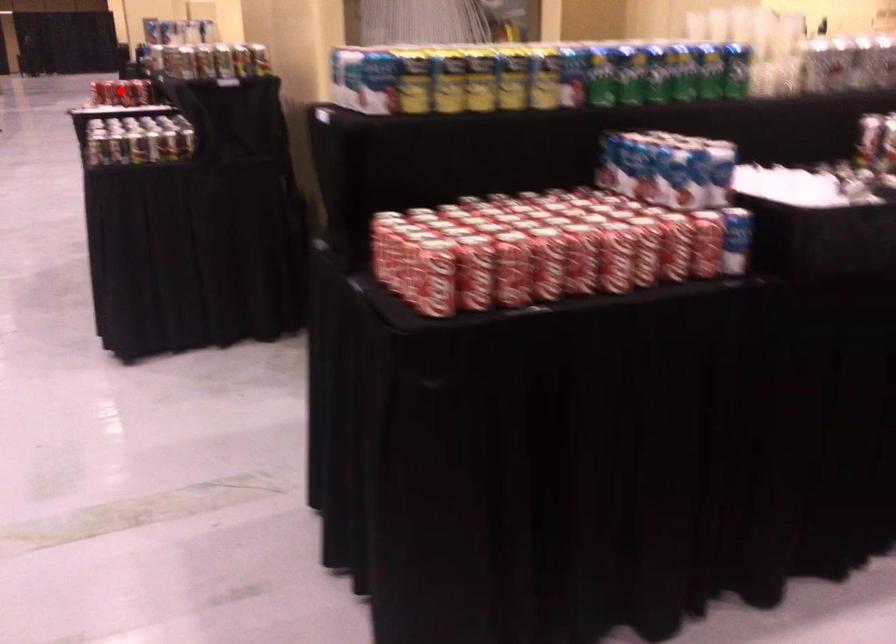
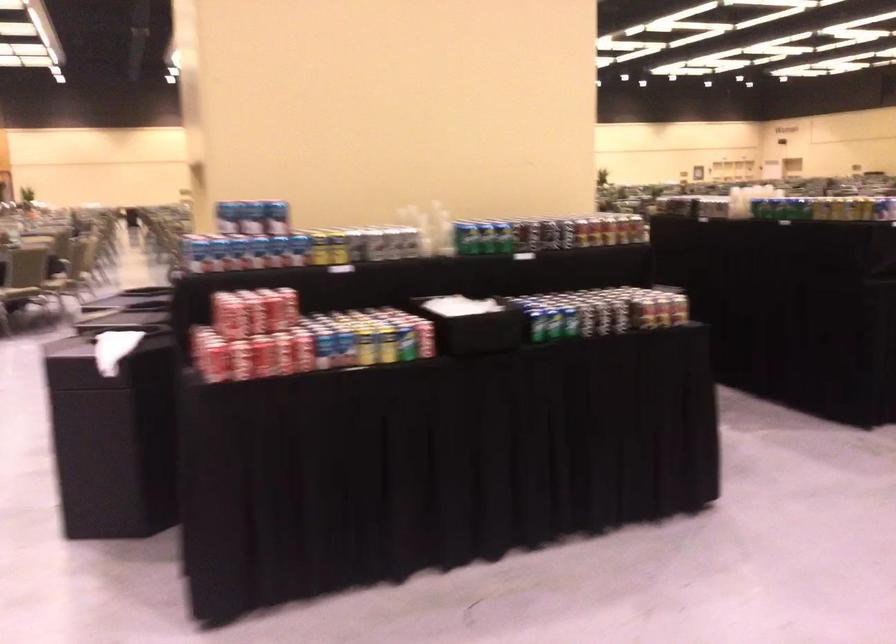
The point at the highlighted location is marked in the first image. Where is the corresponding point in the second image?

(365, 346)